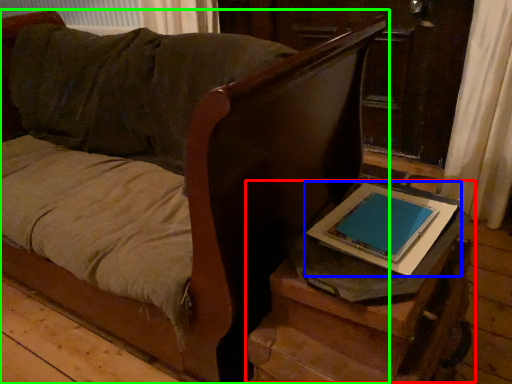
Question: Which is farther away from table (highlighted by a red box)? tablet computer (highlighted by a blue box) or furniture (highlighted by a green box)?

Choices:
 (A) tablet computer
 (B) furniture

Answer: (B)